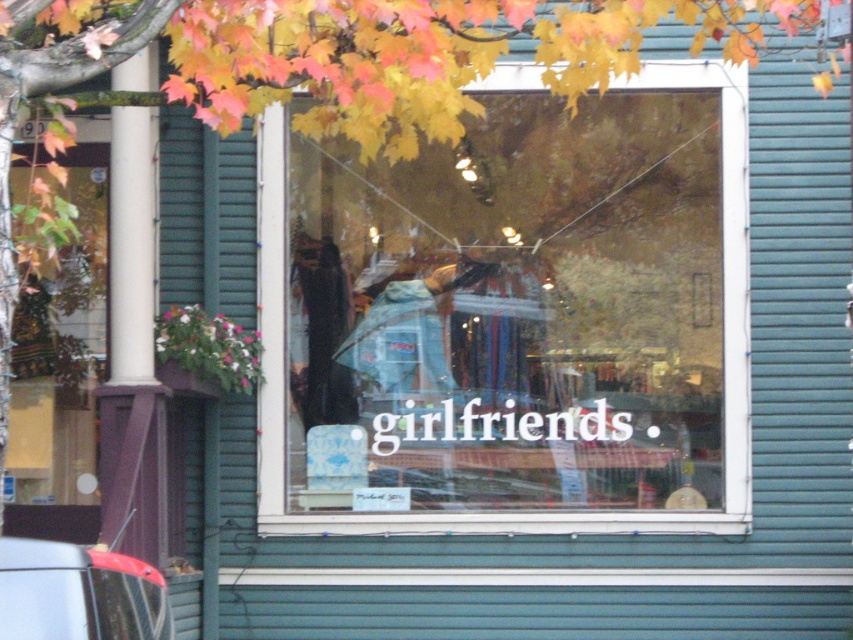
You are standing outside the store looking at the storefront window. There is a point at coordinates point (514, 317). What object does this point correspond to?

The point (514, 317) corresponds to the transparent glass window at center.

Consider the image. You are a delivery person trying to park your metallic gray car at lower left near the transparent glass window at center. Considering the height difference between the two, will the car block the view of the window when parked directly in front of it?

The transparent glass window at center has a greater height compared to the metallic gray car at lower left. Therefore, the metallic gray car at lower left will not completely block the view of the transparent glass window at center when parked directly in front of it since the window is taller.

You are a delivery person trying to park your metallic gray car at lower left near the transparent glass window at center. Based on the scene, can your car fit in the space next to the window?

The transparent glass window at center is larger in size than metallic gray car at lower left, so yes, the metallic gray car at lower left can fit in the space next to the transparent glass window at center since the window is bigger and likely provides enough space.